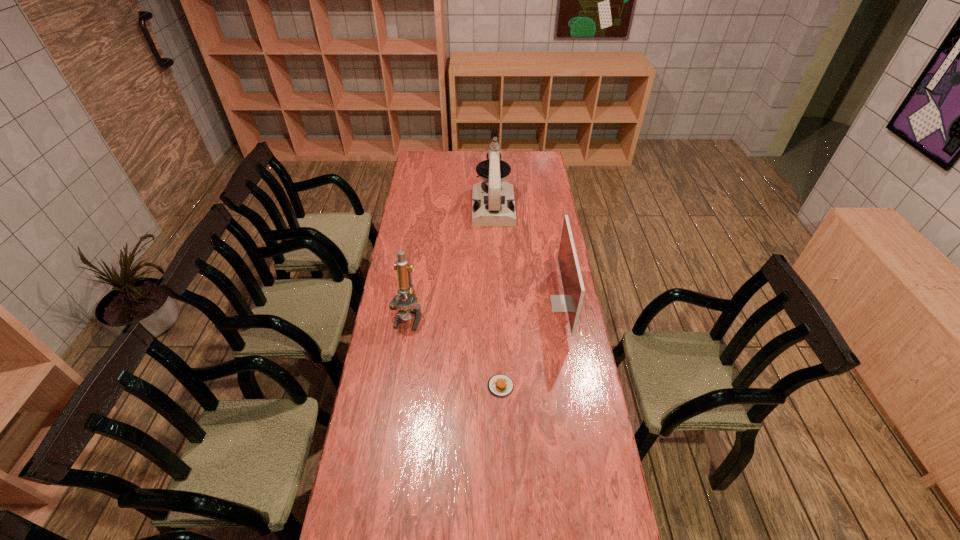
Where is `free space between the monitor and the right microscope`? The width and height of the screenshot is (960, 540). free space between the monitor and the right microscope is located at coordinates (528, 255).

Where is `free point between the leftmost object and the rightmost object`? The image size is (960, 540). free point between the leftmost object and the rightmost object is located at coordinates (486, 310).

This screenshot has height=540, width=960. I want to click on vacant space that's between the rightmost object and the nearer microscope, so click(x=486, y=310).

You are a GUI agent. You are given a task and a screenshot of the screen. Output one action in this format:
    pyautogui.click(x=<x>, y=<y>)
    Task: Click on the vacant area that lies between the monitor and the food
    Image resolution: width=960 pixels, height=540 pixels.
    Given the screenshot: What is the action you would take?
    pyautogui.click(x=532, y=345)

Where is `free space between the tallest object and the nearest object`? free space between the tallest object and the nearest object is located at coordinates (497, 296).

What are the coordinates of `vacant space that's between the rightmost object and the leftmost object` in the screenshot? It's located at (486, 310).

At what (x,y) coordinates should I click in order to perform the action: click on free area in between the nearest object and the farthest object. Please return your answer as a coordinate pair (x, y). This screenshot has height=540, width=960. Looking at the image, I should click on (497, 296).

You are a GUI agent. You are given a task and a screenshot of the screen. Output one action in this format:
    pyautogui.click(x=<x>, y=<y>)
    Task: Click on the empty location between the farther microscope and the shortest object
    This screenshot has width=960, height=540.
    Given the screenshot: What is the action you would take?
    pyautogui.click(x=497, y=296)

Identify the location of object that is the second closest one to the farther microscope. This screenshot has width=960, height=540. (406, 308).

Point out which object is positioned as the third nearest to the food. Please provide its 2D coordinates. Your answer should be formatted as a tuple, i.e. [(x, y)], where the tuple contains the x and y coordinates of a point satisfying the conditions above.

[(493, 204)]